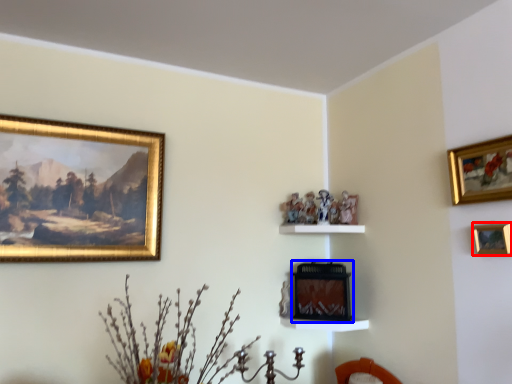
Question: Which of the following is the farthest to the observer, picture frame (highlighted by a red box) or picture frame (highlighted by a blue box)?

Choices:
 (A) picture frame
 (B) picture frame

Answer: (B)